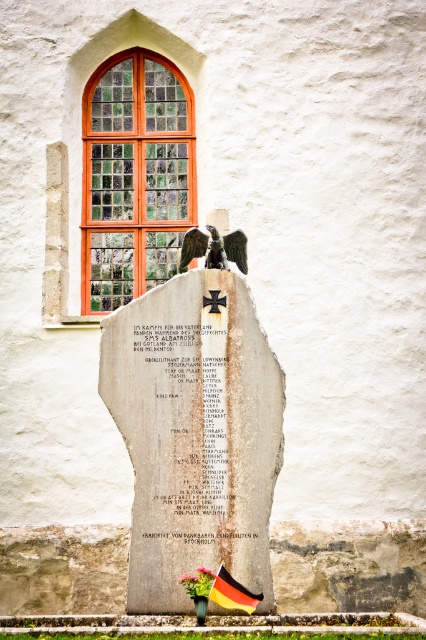
Image resolution: width=426 pixels, height=640 pixels. I want to click on multicolored glass mosaic at upper left, so click(135, 177).

Which is behind, point (114, 276) or point (187, 579)?

Point (114, 276)

Between point (154, 230) and point (184, 582), which one is positioned behind?

The point (154, 230) is behind.

This screenshot has width=426, height=640. Identify the location of multicolored glass mosaic at upper left. (135, 177).

Who is more forward, [218,536] or [242,262]?

Point [218,536] is more forward.

Describe the element at coordinates (195, 426) in the screenshot. The image size is (426, 640). I see `gray stone monument at center` at that location.

The height and width of the screenshot is (640, 426). What do you see at coordinates (195, 426) in the screenshot? I see `gray stone monument at center` at bounding box center [195, 426].

Locate an element on the screen. The height and width of the screenshot is (640, 426). gray stone monument at center is located at coordinates (195, 426).

Who is taller, multicolored glass mosaic at upper left or pink fabric flower at center?

With more height is multicolored glass mosaic at upper left.

At what (x,y) coordinates should I click in order to perform the action: click on multicolored glass mosaic at upper left. Please return your answer as a coordinate pair (x, y). Looking at the image, I should click on (135, 177).